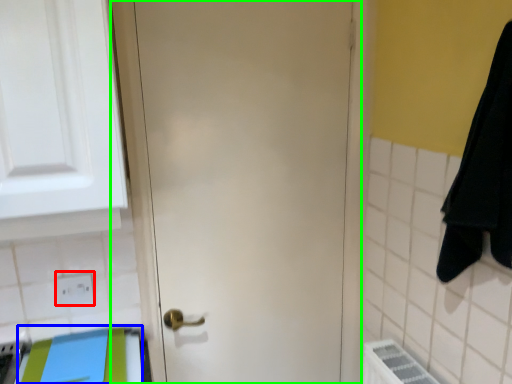
Question: Considering the real-world distances, which object is farthest from electric outlet (highlighted by a red box)? beach towel (highlighted by a blue box) or door (highlighted by a green box)?

Choices:
 (A) beach towel
 (B) door

Answer: (B)